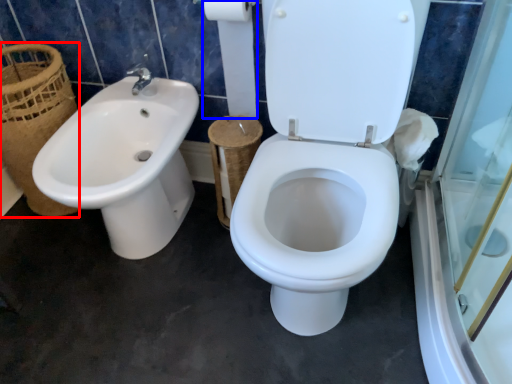
Question: Among these objects, which one is farthest to the camera, basket (highlighted by a red box) or toilet paper (highlighted by a blue box)?

Choices:
 (A) basket
 (B) toilet paper

Answer: (A)